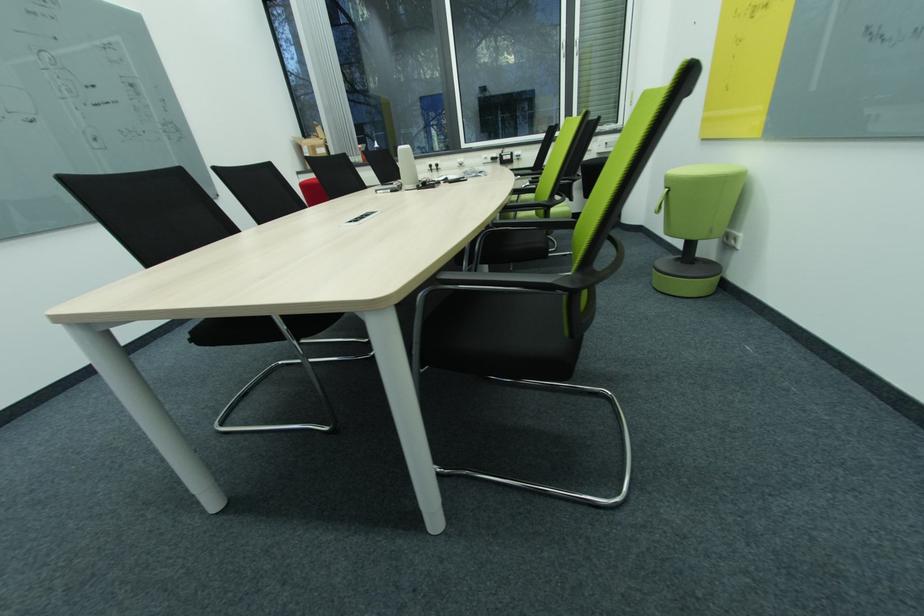
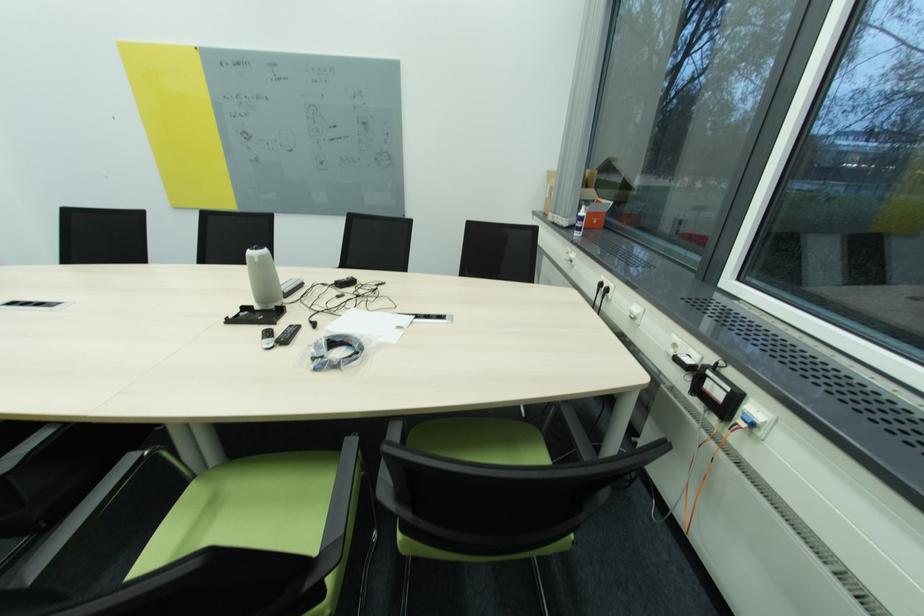
The point at [464,164] is marked in the first image. Where is the corresponding point in the second image?

(636, 314)